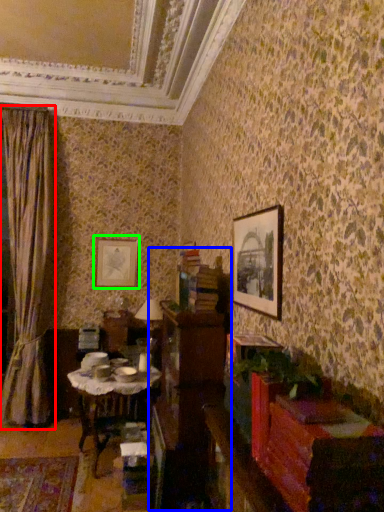
Question: Which is nearer to the curtain (highlighted by a red box)? dresser (highlighted by a blue box) or picture frame (highlighted by a green box).

Choices:
 (A) dresser
 (B) picture frame

Answer: (B)